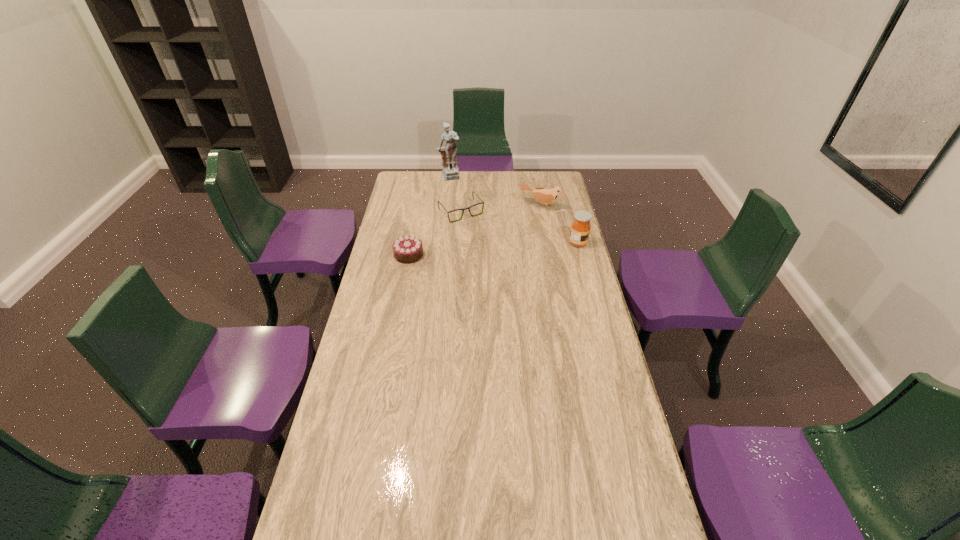
Where is `bird that is at the right edge`? The image size is (960, 540). bird that is at the right edge is located at coordinates (546, 196).

I want to click on vacant space at the far edge of the desktop, so click(456, 189).

What are the coordinates of `vacant space at the left edge` in the screenshot? It's located at (385, 296).

Locate an element on the screen. This screenshot has height=540, width=960. vacant space at the right edge of the desktop is located at coordinates (575, 332).

In the image, there is a desktop. Where is `blank space at the near left corner`? blank space at the near left corner is located at coordinates (345, 516).

In the image, there is a desktop. Identify the location of vacant region at the far right corner. (564, 189).

Image resolution: width=960 pixels, height=540 pixels. Identify the location of vacant area that lies between the farthest object and the honey. (514, 210).

Identify the location of empty space between the spectacles and the tallest object. This screenshot has height=540, width=960. (455, 194).

You are a GUI agent. You are given a task and a screenshot of the screen. Output one action in this format:
    pyautogui.click(x=<x>, y=<y>)
    Task: Click on the free space between the tallest object and the leftmost object
    
    Given the screenshot: What is the action you would take?
    pyautogui.click(x=429, y=216)

Where is `vacant area that lies between the leftmost object and the figurine`? This screenshot has width=960, height=540. vacant area that lies between the leftmost object and the figurine is located at coordinates (429, 216).